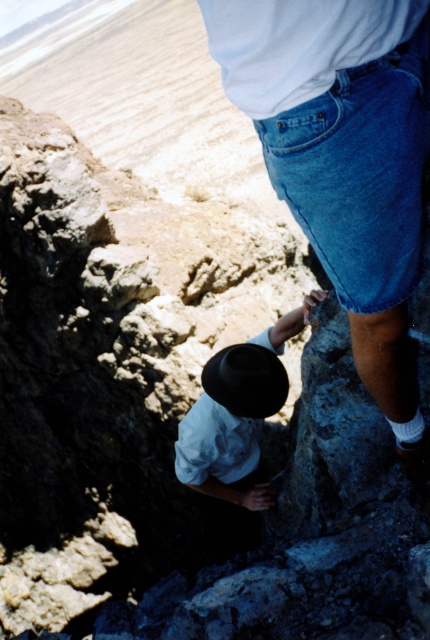
Question: Does denim shorts at center have a lesser width compared to white cotton shirt at center?

Choices:
 (A) yes
 (B) no

Answer: (A)

Question: Which point is closer to the camera?

Choices:
 (A) (392, 186)
 (B) (224, 397)

Answer: (A)

Question: Considering the real-world distances, which object is farthest from the black felt hat at center?

Choices:
 (A) denim shorts at center
 (B) white cotton shirt at center

Answer: (A)

Question: Is denim shorts at center to the left of white cotton shirt at center from the viewer's perspective?

Choices:
 (A) yes
 (B) no

Answer: (B)

Question: Can you confirm if denim shorts at center is positioned below black felt hat at center?

Choices:
 (A) no
 (B) yes

Answer: (A)

Question: Among these points, which one is farthest from the camera?

Choices:
 (A) (251, 371)
 (B) (212, 493)

Answer: (B)